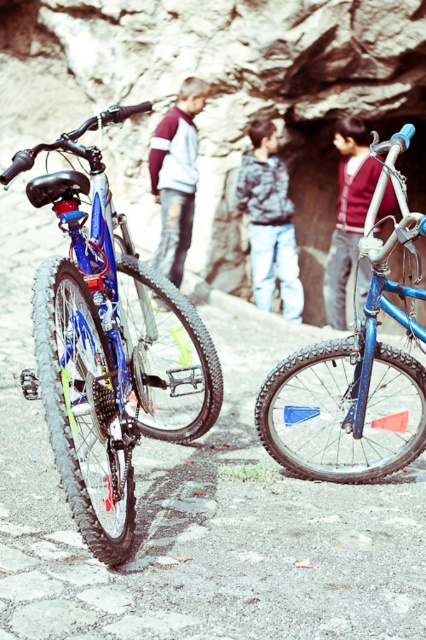
Which is behind, point (299, 355) or point (192, 189)?

Point (192, 189)

Can you confirm if blue matte mountain bike at center is smaller than ripped denim jeans at center?

Incorrect, blue matte mountain bike at center is not smaller in size than ripped denim jeans at center.

At what (x,y) coordinates should I click in order to perform the action: click on blue matte mountain bike at center. Please return your answer as a coordinate pair (x, y). Image resolution: width=426 pixels, height=640 pixels. Looking at the image, I should click on (354, 372).

Find the location of `blue matte mountain bike at center`. blue matte mountain bike at center is located at coordinates (354, 372).

Which is behind, point (233, 448) or point (181, 163)?

Positioned behind is point (181, 163).

The height and width of the screenshot is (640, 426). In order to click on shiny metallic bicycle at center in this screenshot , I will do `click(207, 522)`.

Where is `shiny metallic bicycle at center`? This screenshot has width=426, height=640. shiny metallic bicycle at center is located at coordinates (207, 522).

The image size is (426, 640). Describe the element at coordinates (354, 372) in the screenshot. I see `blue matte mountain bike at center` at that location.

Is blue matte mountain bike at center to the left of textured gray hoodie at center from the viewer's perspective?

No, blue matte mountain bike at center is not to the left of textured gray hoodie at center.

This screenshot has width=426, height=640. Describe the element at coordinates (354, 372) in the screenshot. I see `blue matte mountain bike at center` at that location.

Image resolution: width=426 pixels, height=640 pixels. Find the location of `blue matte mountain bike at center`. blue matte mountain bike at center is located at coordinates pyautogui.click(x=354, y=372).